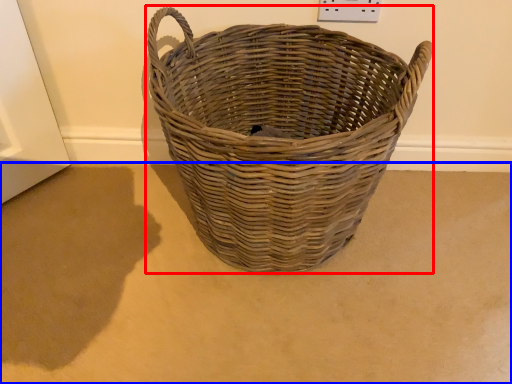
Question: Which object appears closest to the camera in this image, picnic basket (highlighted by a red box) or plain (highlighted by a blue box)?

Choices:
 (A) picnic basket
 (B) plain

Answer: (A)